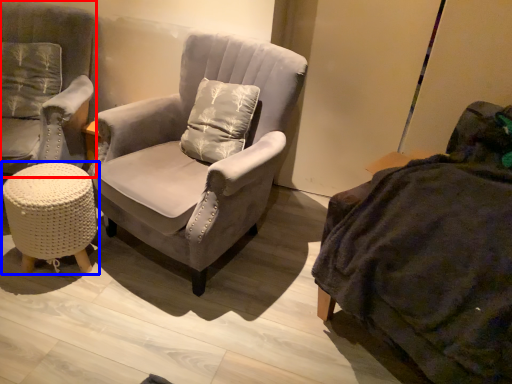
Question: Which object appears farthest to the camera in this image, chair (highlighted by a red box) or table (highlighted by a blue box)?

Choices:
 (A) chair
 (B) table

Answer: (B)